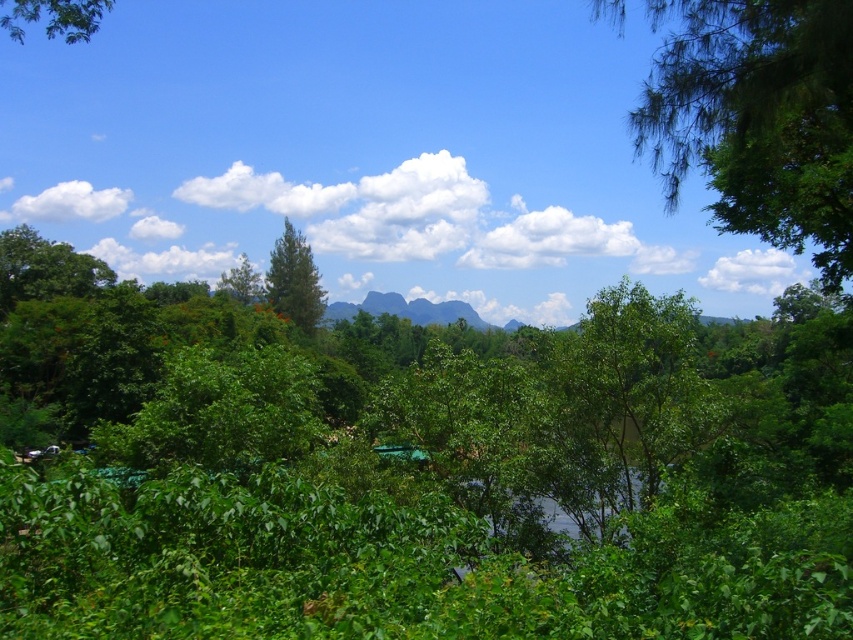
Who is lower down, green leafy tree at upper right or green leafy tree at upper left?

green leafy tree at upper right

Which is above, green leafy tree at upper right or green leafy tree at upper left?

Positioned higher is green leafy tree at upper left.

Between point (799, 225) and point (82, 29), which one is positioned behind?

Point (799, 225)

Where is `green leafy tree at upper right`? The height and width of the screenshot is (640, 853). green leafy tree at upper right is located at coordinates (758, 116).

Does point (57, 13) come farther from viewer compared to point (515, 321)?

No, (57, 13) is in front of (515, 321).

Does green leafy tree at upper left appear under green rock formation at center?

No.

Identify the location of green leafy tree at upper left. (54, 17).

Find the location of a particular element. The height and width of the screenshot is (640, 853). green leafy tree at upper left is located at coordinates (54, 17).

Does point (102, 0) come behind point (225, 278)?

No, (102, 0) is closer to viewer.

Is green leafy tree at upper left shorter than green leafy tree at center?

In fact, green leafy tree at upper left may be taller than green leafy tree at center.

Between point (48, 17) and point (260, 285), which one is positioned in front?

Point (48, 17) is in front.

Find the location of a particular element. This screenshot has height=640, width=853. green leafy tree at upper left is located at coordinates (54, 17).